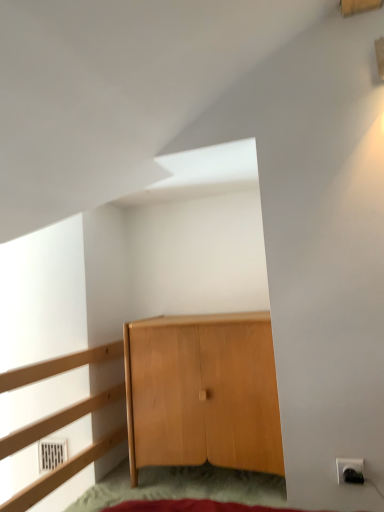
Question: In terms of height, does light brown wood cabinet at center look taller or shorter compared to light wood dresser at left?

Choices:
 (A) short
 (B) tall

Answer: (A)

Question: Is light brown wood cabinet at center in front of or behind light wood dresser at left in the image?

Choices:
 (A) behind
 (B) front

Answer: (A)

Question: Which object is positioned farthest from the light wood dresser at left?

Choices:
 (A) light brown wood cabinet at center
 (B) white plastic electric outlet at lower right

Answer: (B)

Question: Considering the real-world distances, which object is closest to the light wood dresser at left?

Choices:
 (A) light brown wood cabinet at center
 (B) white plastic electric outlet at lower right

Answer: (A)